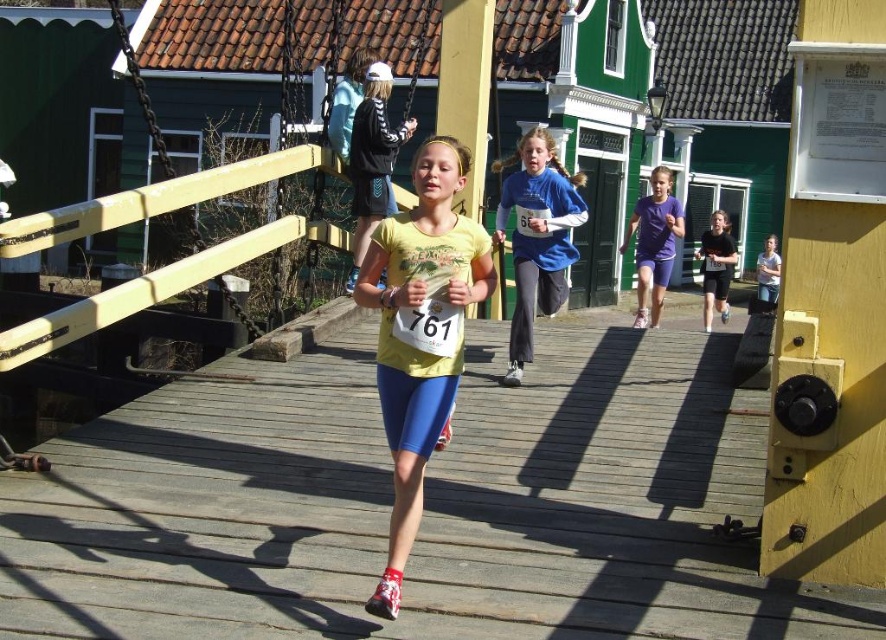
Does blue fabric shirt at center appear on the right side of light blue fabric shirt at center?

No, blue fabric shirt at center is not to the right of light blue fabric shirt at center.

Is blue fabric shirt at center taller than light blue fabric shirt at center?

Indeed, blue fabric shirt at center has a greater height compared to light blue fabric shirt at center.

Does point (511, 257) lie behind point (762, 298)?

No.

The image size is (886, 640). Identify the location of blue fabric shirt at center. (537, 237).

How far apart are yellow matte t-shirt at center and matte black shorts at center?

The distance of yellow matte t-shirt at center from matte black shorts at center is 11.92 meters.

Who is positioned more to the left, yellow matte t-shirt at center or matte black shorts at center?

From the viewer's perspective, yellow matte t-shirt at center appears more on the left side.

Is point (431, 170) less distant than point (729, 310)?

Yes, point (431, 170) is in front of point (729, 310).

The image size is (886, 640). Find the location of `yellow matte t-shirt at center`. yellow matte t-shirt at center is located at coordinates (421, 332).

Between matte black jacket at upper left and purple matte shorts at right, which one has more height?

Standing taller between the two is matte black jacket at upper left.

Is point (356, 259) in front of point (636, 205)?

Yes, point (356, 259) is closer to viewer.

This screenshot has width=886, height=640. In order to click on matte black jacket at upper left in this screenshot , I will do `click(372, 161)`.

Identify the location of matte black jacket at upper left. Image resolution: width=886 pixels, height=640 pixels. (372, 161).